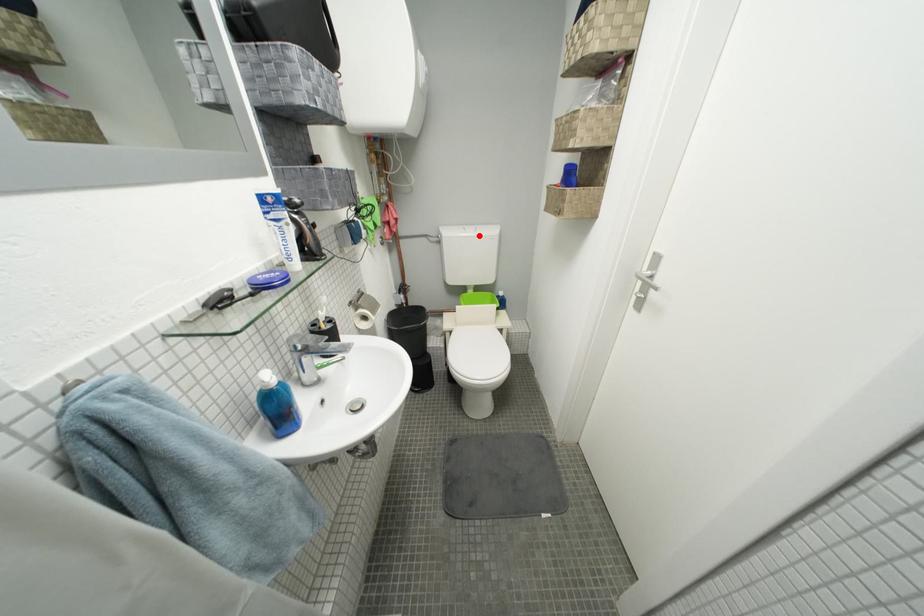
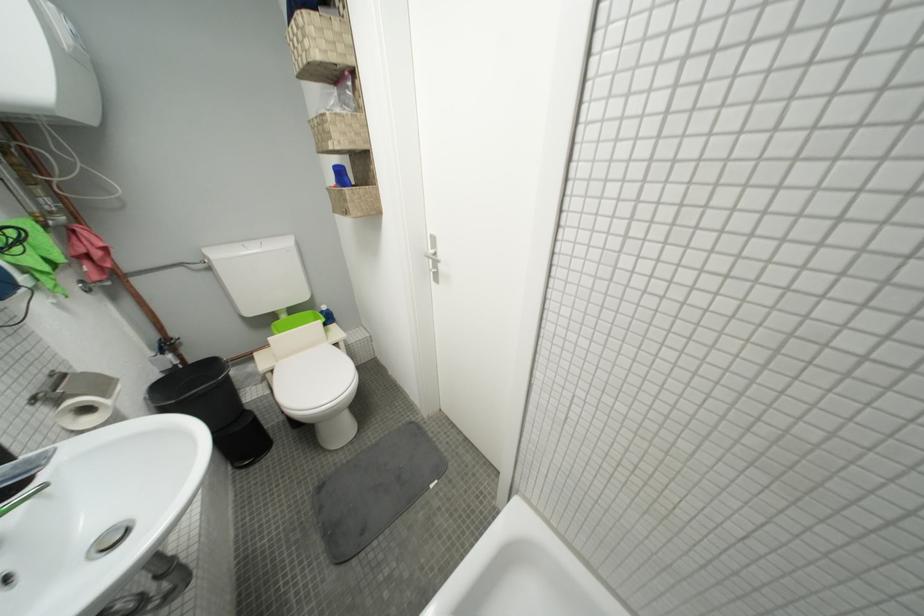
Question: I am providing you with two images of the same scene from different viewpoints. Image1 has a red point marked. In image2, the corresponding 3D location appears at what relative position? Reply with the corresponding letter.

Choices:
 (A) Closer
 (B) Farther

Answer: (B)